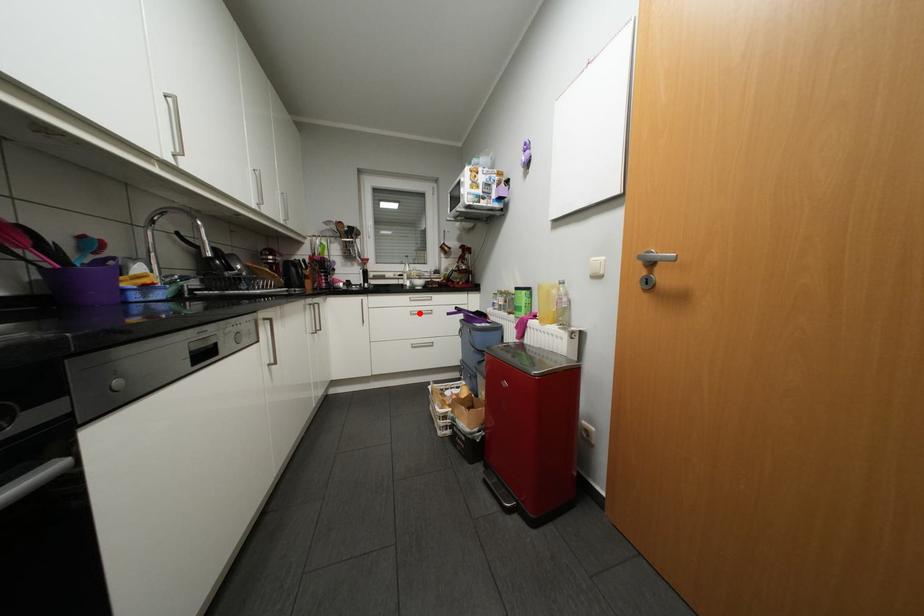
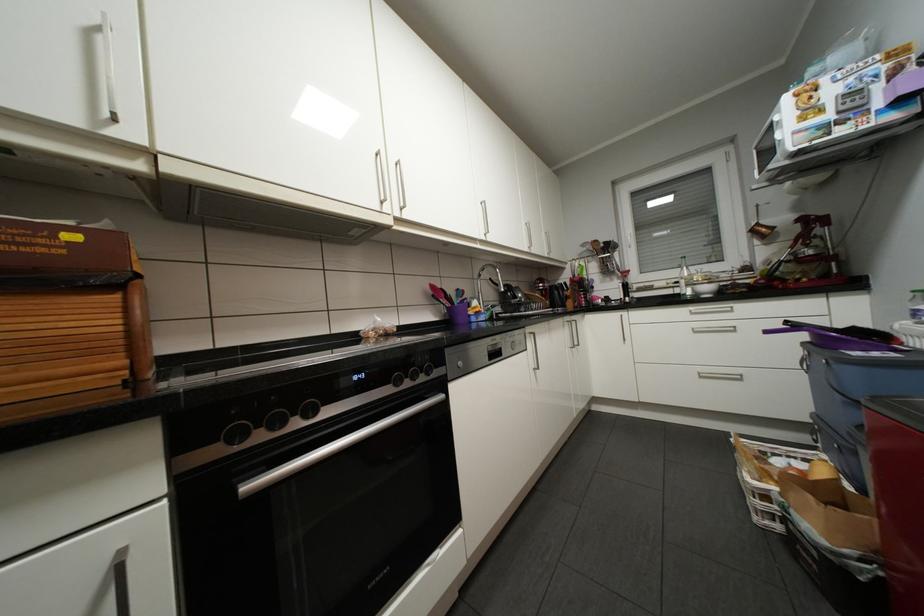
Question: I am providing you with two images of the same scene from different viewpoints. Given a red point in image1, look at the same physical point in image2. Is it:

Choices:
 (A) Closer to the viewpoint
 (B) Farther from the viewpoint

Answer: (A)